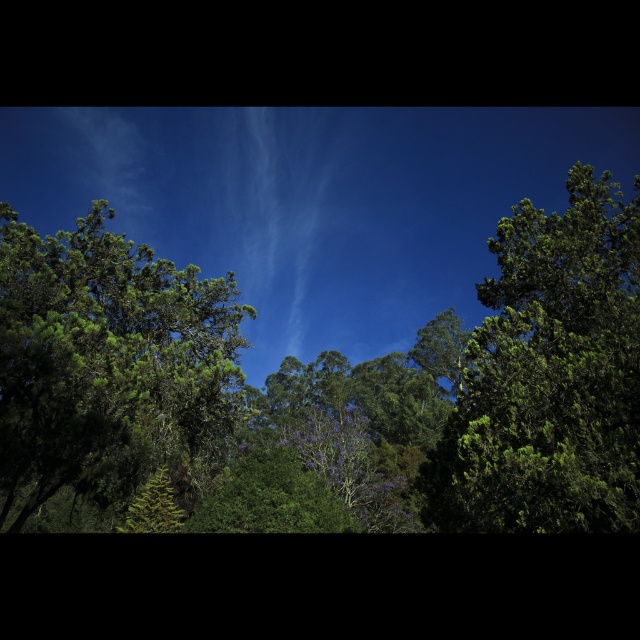
Which of these two, green leafy tree at left or green leafy tree at right, stands shorter?

Standing shorter between the two is green leafy tree at right.

Can you confirm if green leafy tree at left is shorter than green leafy tree at right?

In fact, green leafy tree at left may be taller than green leafy tree at right.

Locate an element on the screen. green leafy tree at left is located at coordinates pyautogui.click(x=108, y=369).

Where is `green leafy tree at left`? green leafy tree at left is located at coordinates (108, 369).

Does point (616, 205) lie in front of point (456, 372)?

Yes, it is in front of point (456, 372).

Is point (547, 497) farther from camera compared to point (419, 355)?

No, it is in front of (419, 355).

Where is `green leafy tree at right`? The height and width of the screenshot is (640, 640). green leafy tree at right is located at coordinates (548, 376).

Between point (188, 301) and point (433, 328), which one is positioned in front?

Point (188, 301)

Does point (506, 356) lie in front of point (461, 344)?

Yes, point (506, 356) is in front of point (461, 344).

Does point (228, 301) come in front of point (442, 376)?

Yes, it is in front of point (442, 376).

Locate an element on the screen. The image size is (640, 640). green leafy forest at center is located at coordinates (321, 394).